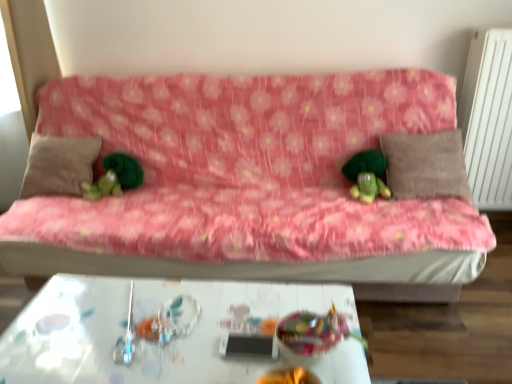
Image resolution: width=512 pixels, height=384 pixels. What do you see at coordinates (315, 332) in the screenshot?
I see `translucent plastic bowl at center, arranged as the 2th toy when viewed from the top` at bounding box center [315, 332].

Identify the location of pink fabric couch at center. (252, 178).

Image resolution: width=512 pixels, height=384 pixels. Find the location of `green plush toy at center`. green plush toy at center is located at coordinates (367, 175).

Identify the location of white textured radiator at right. (488, 118).

Describe the element at coordinates (145, 341) in the screenshot. I see `white glossy table at center` at that location.

Where is `white glossy table at center`? The height and width of the screenshot is (384, 512). white glossy table at center is located at coordinates tap(145, 341).

At what (x,y) coordinates should I click in order to perform the action: click on translucent plastic bowl at center, arranged as the 2th toy when viewed from the top. Please return your answer as a coordinate pair (x, y). The height and width of the screenshot is (384, 512). Looking at the image, I should click on (x=315, y=332).

Which object is wider, pink fabric couch at center or white glossy table at center?

white glossy table at center is wider.

Are pink fabric couch at center and white glossy table at center located far from each other?

No, there isn't a large distance between pink fabric couch at center and white glossy table at center.

Can you confirm if pink fabric couch at center is positioned to the right of white glossy table at center?

Yes, pink fabric couch at center is to the right of white glossy table at center.

In terms of height, does pink fabric couch at center look taller or shorter compared to white glossy table at center?

pink fabric couch at center is taller than white glossy table at center.

Based on the photo, is green plush toy at left, placed as the 2th toy when sorted from front to back, looking in the opposite direction of white textured radiator at right?

No, green plush toy at left, placed as the 2th toy when sorted from front to back, is not facing the opposite direction of white textured radiator at right.

Would you consider green plush toy at left, placed as the 2th toy when sorted from front to back, to be distant from white textured radiator at right?

green plush toy at left, placed as the 2th toy when sorted from front to back, is positioned a significant distance from white textured radiator at right.

Is the position of green plush toy at left, positioned as the 1th toy in back-to-front order, less distant than that of white textured radiator at right?

No, green plush toy at left, positioned as the 1th toy in back-to-front order, is further to the viewer.

Looking at this image, from a real-world perspective, which is physically below, green plush toy at left, which is the first toy in left-to-right order, or white textured radiator at right?

green plush toy at left, which is the first toy in left-to-right order.

Which object is positioned more to the left, white textured radiator at right or pink fabric couch at center?

From the viewer's perspective, pink fabric couch at center appears more on the left side.

Is white textured radiator at right shorter than pink fabric couch at center?

In fact, white textured radiator at right may be taller than pink fabric couch at center.

How much distance is there between white textured radiator at right and pink fabric couch at center?

The distance of white textured radiator at right from pink fabric couch at center is 34.77 inches.

In the image, is white textured radiator at right positioned in front of or behind pink fabric couch at center?

Clearly, white textured radiator at right is behind pink fabric couch at center.

Would you say green plush toy at left, the second toy when ordered from bottom to top, is to the left or to the right of beige fabric pillow at left, which is the 1th pillow from left to right, in the picture?

From the image, it's evident that green plush toy at left, the second toy when ordered from bottom to top, is to the right of beige fabric pillow at left, which is the 1th pillow from left to right.

Is green plush toy at left, placed as the first toy when sorted from top to bottom, beside beige fabric pillow at left, the second pillow viewed from the right?

No, green plush toy at left, placed as the first toy when sorted from top to bottom, is not touching beige fabric pillow at left, the second pillow viewed from the right.

In the image, is green plush toy at left, placed as the 2th toy when sorted from front to back, positioned in front of or behind beige fabric pillow at left, the second pillow viewed from the right?

green plush toy at left, placed as the 2th toy when sorted from front to back, is behind beige fabric pillow at left, the second pillow viewed from the right.

This screenshot has height=384, width=512. Identify the location of toy lying behind the pink fabric couch at center. (115, 177).

Consider the image. Between green plush toy at left, the second toy when ordered from bottom to top, and pink fabric couch at center, which one has smaller size?

green plush toy at left, the second toy when ordered from bottom to top, is smaller.

From the image's perspective, is green plush toy at left, the 2th toy from the right, below pink fabric couch at center?

Incorrect, from the image's perspective, green plush toy at left, the 2th toy from the right, is higher than pink fabric couch at center.

From the image's perspective, which is below, brown fabric pillow at right, which appears as the 2th pillow when viewed from the left, or green plush toy at left, placed as the first toy when sorted from top to bottom?

green plush toy at left, placed as the first toy when sorted from top to bottom.

From the picture: From a real-world perspective, is brown fabric pillow at right, placed as the 1th pillow when sorted from right to left, below green plush toy at left, placed as the 2th toy when sorted from front to back?

No.

Looking at their sizes, would you say brown fabric pillow at right, placed as the 1th pillow when sorted from right to left, is wider or thinner than green plush toy at left, placed as the first toy when sorted from top to bottom?

brown fabric pillow at right, placed as the 1th pillow when sorted from right to left, is wider than green plush toy at left, placed as the first toy when sorted from top to bottom.

Would you consider brown fabric pillow at right, placed as the 1th pillow when sorted from right to left, to be distant from green plush toy at left, the 2th toy from the right?

Yes, brown fabric pillow at right, placed as the 1th pillow when sorted from right to left, and green plush toy at left, the 2th toy from the right, are located far from each other.

From a real-world perspective, is white glossy table at center above or below beige fabric pillow at left, the second pillow viewed from the right?

From a real-world perspective, white glossy table at center is physically below beige fabric pillow at left, the second pillow viewed from the right.

Choose the correct answer: Is white glossy table at center inside beige fabric pillow at left, which is the 1th pillow from left to right, or outside it?

white glossy table at center cannot be found inside beige fabric pillow at left, which is the 1th pillow from left to right.

Considering the relative positions of white glossy table at center and beige fabric pillow at left, the second pillow viewed from the right, in the image provided, is white glossy table at center to the right of beige fabric pillow at left, the second pillow viewed from the right, from the viewer's perspective?

Yes, white glossy table at center is to the right of beige fabric pillow at left, the second pillow viewed from the right.

Does white glossy table at center have a larger size compared to beige fabric pillow at left, the second pillow viewed from the right?

Yes.

I want to click on table on the left side of pink fabric couch at center, so click(x=145, y=341).

Identify the location of radiator that appears in front of the green plush toy at left, the second toy when ordered from bottom to top. (488, 118).

When comparing their distances from white textured radiator at right, does translucent plastic bowl at center, the 1th toy when ordered from front to back, or white glossy table at center seem closer?

translucent plastic bowl at center, the 1th toy when ordered from front to back, is closer to white textured radiator at right.

Based on their spatial positions, is brown fabric pillow at right, which appears as the 2th pillow when viewed from the left, or green plush toy at left, placed as the 2th toy when sorted from front to back, further from white textured radiator at right?

The object further to white textured radiator at right is green plush toy at left, placed as the 2th toy when sorted from front to back.

Looking at this image, looking at the image, which one is located further to brown fabric pillow at right, placed as the 1th pillow when sorted from right to left, translucent plastic bowl at center, the 1th toy when ordered from right to left, or pink fabric couch at center?

translucent plastic bowl at center, the 1th toy when ordered from right to left, lies further to brown fabric pillow at right, placed as the 1th pillow when sorted from right to left, than the other object.

Based on their spatial positions, is translucent plastic bowl at center, arranged as the 2th toy when viewed from the top, or brown fabric pillow at right, which appears as the 2th pillow when viewed from the left, closer to green plush toy at left, the second toy when ordered from bottom to top?

translucent plastic bowl at center, arranged as the 2th toy when viewed from the top, lies closer to green plush toy at left, the second toy when ordered from bottom to top, than the other object.

Based on their spatial positions, is pink fabric couch at center or translucent plastic bowl at center, the 1th toy when ordered from front to back, further from green plush toy at left, positioned as the 1th toy in back-to-front order?

translucent plastic bowl at center, the 1th toy when ordered from front to back.

From the picture: Looking at the image, which one is located further to brown fabric pillow at right, placed as the 1th pillow when sorted from right to left, green plush toy at left, placed as the first toy when sorted from top to bottom, or beige fabric pillow at left, which is the 1th pillow from left to right?

beige fabric pillow at left, which is the 1th pillow from left to right.

Based on their spatial positions, is green plush toy at left, the 2th toy from the right, or translucent plastic bowl at center, arranged as the second toy when viewed from the back, further from pink fabric couch at center?

translucent plastic bowl at center, arranged as the second toy when viewed from the back, is positioned further to the anchor pink fabric couch at center.

From the image, which object appears to be nearer to white textured radiator at right, translucent plastic bowl at center, arranged as the second toy when viewed from the back, or green plush toy at left, placed as the 2th toy when sorted from front to back?

translucent plastic bowl at center, arranged as the second toy when viewed from the back, is closer to white textured radiator at right.

Locate an element on the screen. studio couch situated between green plush toy at left, the 2th toy from the right, and green plush toy at center from left to right is located at coordinates (252, 178).

I want to click on table between green plush toy at left, placed as the 2th toy when sorted from front to back, and brown fabric pillow at right, which appears as the 2th pillow when viewed from the left, from left to right, so click(x=145, y=341).

What are the coordinates of `toy between white glossy table at center and brown fabric pillow at right, which appears as the 2th pillow when viewed from the left, in the horizontal direction` in the screenshot? It's located at (315, 332).

This screenshot has height=384, width=512. I want to click on studio couch located between beige fabric pillow at left, which is the 1th pillow from left to right, and green plush toy at center in the left-right direction, so click(252, 178).